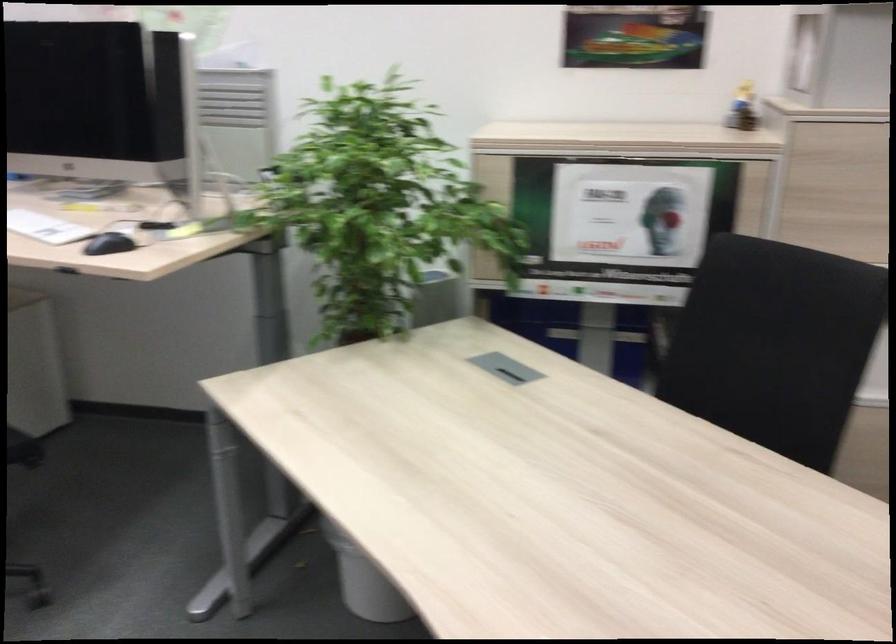
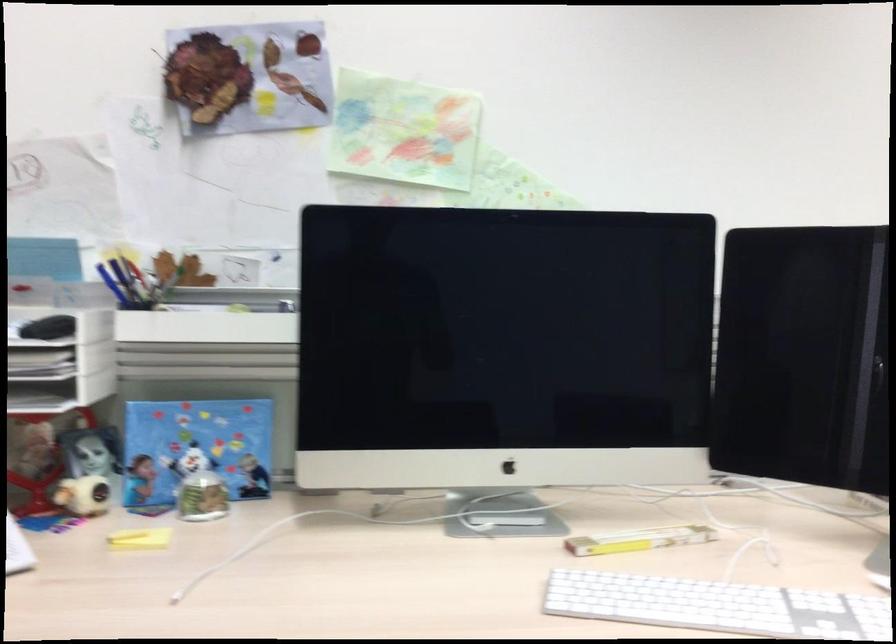
In the second image, find the point that corresponds to pixel 107 210 in the first image.

(638, 540)